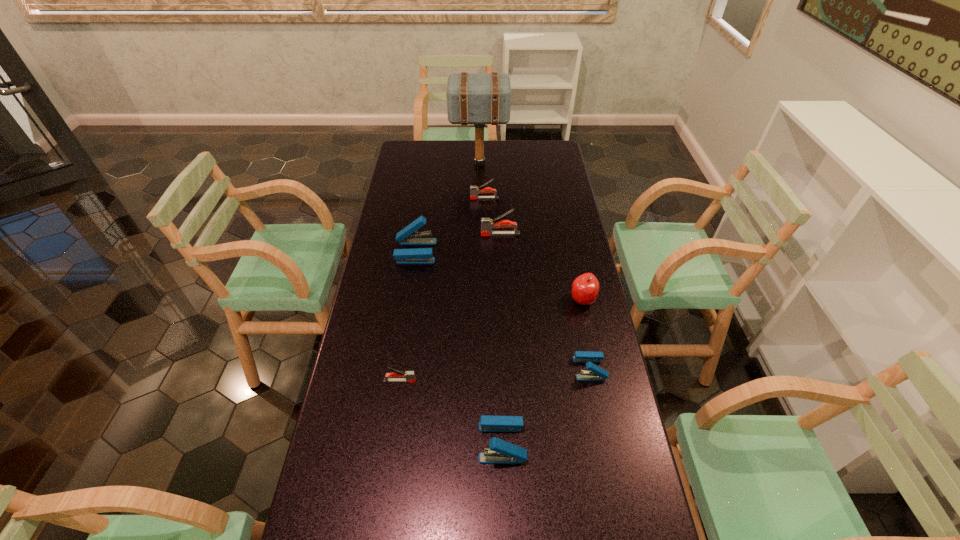
Identify the location of mallet. (472, 98).

Where is `the tallest object`? Image resolution: width=960 pixels, height=540 pixels. the tallest object is located at coordinates (472, 98).

In order to click on the second farthest gray stapler in this screenshot , I will do `click(487, 224)`.

Where is `the second farthest stapler`? The width and height of the screenshot is (960, 540). the second farthest stapler is located at coordinates (487, 224).

At what (x,y) coordinates should I click in order to perform the action: click on the biggest blue stapler. Please return your answer as a coordinate pair (x, y). The width and height of the screenshot is (960, 540). Looking at the image, I should click on (408, 236).

Locate an element on the screen. This screenshot has width=960, height=540. the farthest blue stapler is located at coordinates (408, 236).

Where is `the fifth farthest object`? the fifth farthest object is located at coordinates (585, 288).

Where is `red apple`? red apple is located at coordinates (585, 288).

Identify the location of the seventh nearest object. This screenshot has width=960, height=540. (474, 191).

What are the coordinates of `the farthest gray stapler` in the screenshot? It's located at (474, 191).